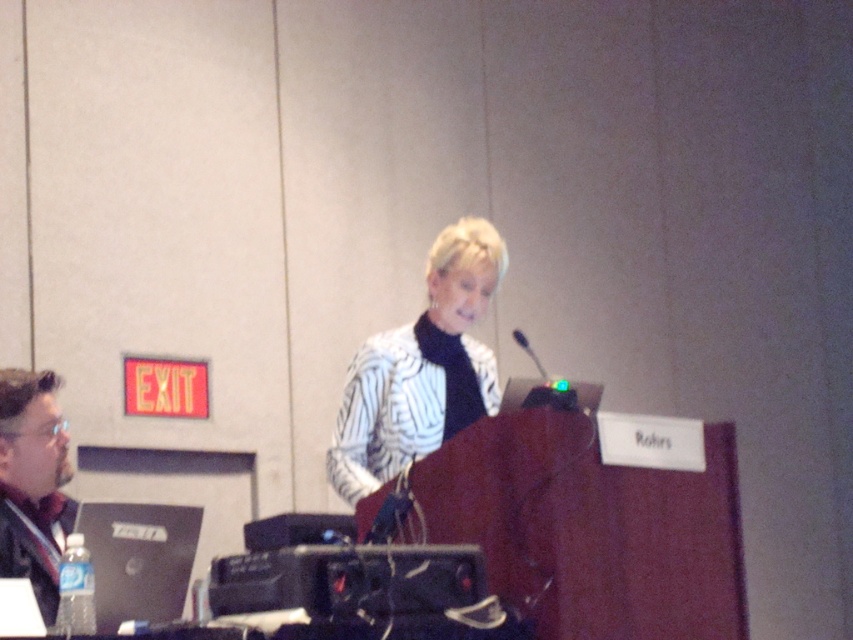
At what (x,y) coordinates should I click in order to perform the action: click on white textured blazer at center. Please return your answer as a coordinate pair (x, y). Looking at the image, I should click on (421, 369).

Is white textured blazer at center smaller than black plastic microphone at center?

Actually, white textured blazer at center might be larger than black plastic microphone at center.

I want to click on white textured blazer at center, so click(x=421, y=369).

Is matte black laptop at left above black plastic microphone at center?

No.

Does matte black laptop at left come behind black plastic microphone at center?

No, it is not.

Is point (12, 480) closer to camera compared to point (524, 333)?

Yes, it is.

This screenshot has width=853, height=640. I want to click on matte black laptop at left, so click(x=33, y=483).

In the scene shown: How far apart are white textured blazer at center and matte black laptop at left?

A distance of 3.50 feet exists between white textured blazer at center and matte black laptop at left.

Who is positioned more to the left, white textured blazer at center or matte black laptop at left?

matte black laptop at left is more to the left.

Describe the element at coordinates (421, 369) in the screenshot. The height and width of the screenshot is (640, 853). I see `white textured blazer at center` at that location.

The height and width of the screenshot is (640, 853). Find the location of `white textured blazer at center`. white textured blazer at center is located at coordinates (421, 369).